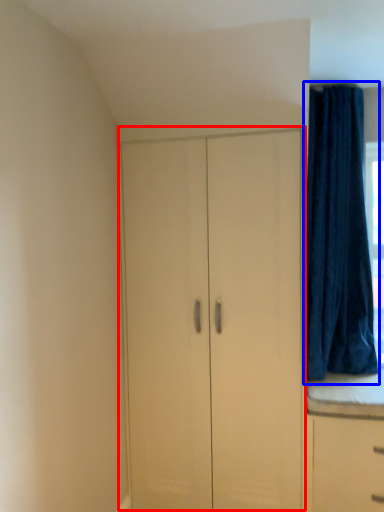
Question: Which point is closer to the camera, cupboard (highlighted by a red box) or curtain (highlighted by a blue box)?

Choices:
 (A) cupboard
 (B) curtain

Answer: (A)